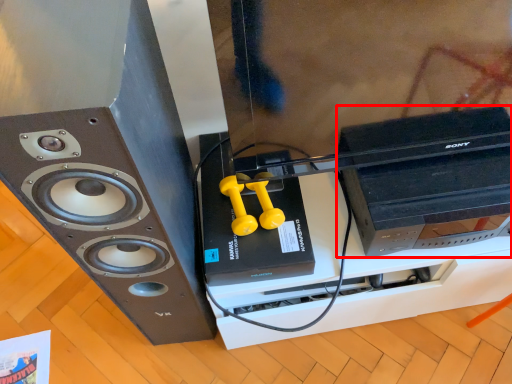
Question: Considering the relative positions of computer (annotated by the red box) and home appliance in the image provided, where is computer (annotated by the red box) located with respect to the staircase?

Choices:
 (A) left
 (B) right

Answer: (B)